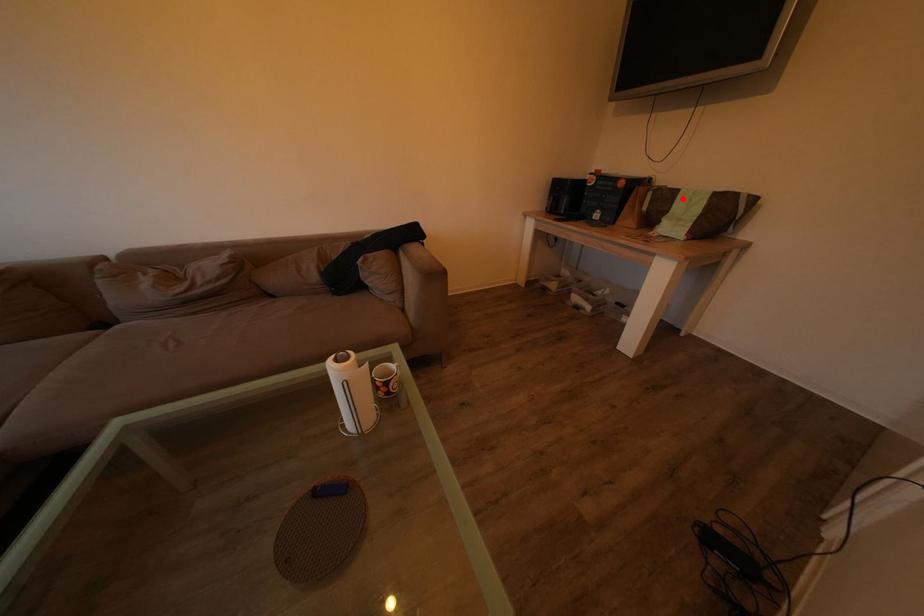
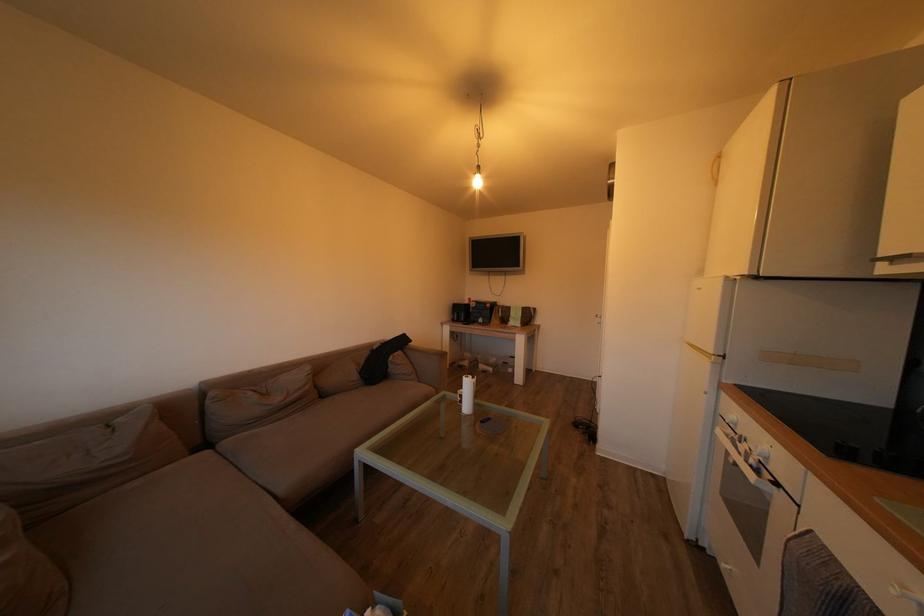
Question: I am providing you with two images of the same scene from different viewpoints. Image1 has a red point marked. In image2, the corresponding 3D location appears at what relative position? Reply with the corresponding letter.

Choices:
 (A) Closer
 (B) Farther

Answer: (B)